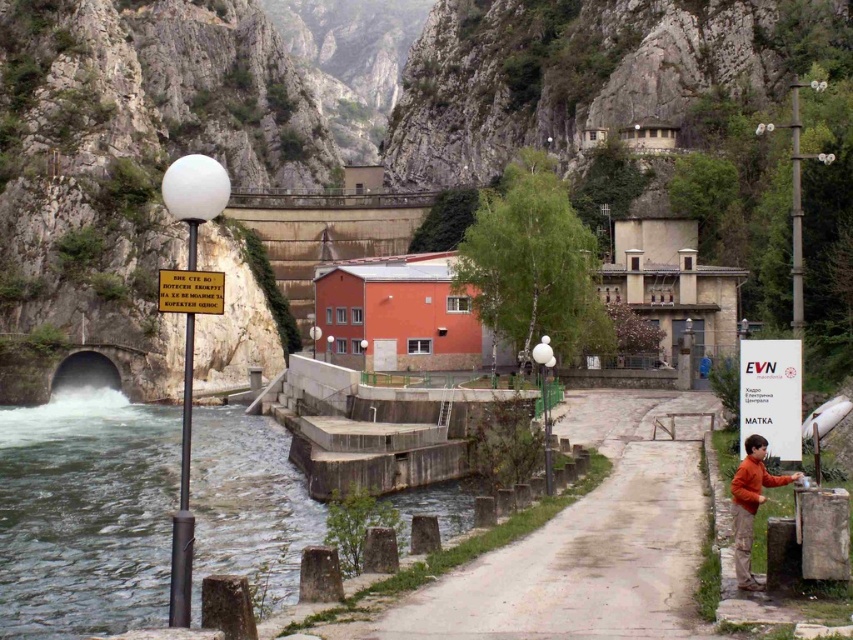
Question: Which object appears closest to the camera in this image?

Choices:
 (A) gray concrete path at center
 (B) orange cotton shirt at lower right

Answer: (A)

Question: Can you confirm if gray concrete path at center is positioned below orange cotton shirt at lower right?

Choices:
 (A) yes
 (B) no

Answer: (A)

Question: Which of the following is the farthest from the observer?

Choices:
 (A) (749, 451)
 (B) (660, 400)

Answer: (B)

Question: Is gray concrete path at center positioned in front of orange cotton shirt at lower right?

Choices:
 (A) yes
 (B) no

Answer: (A)

Question: Does gray concrete path at center lie in front of orange cotton shirt at lower right?

Choices:
 (A) yes
 (B) no

Answer: (A)